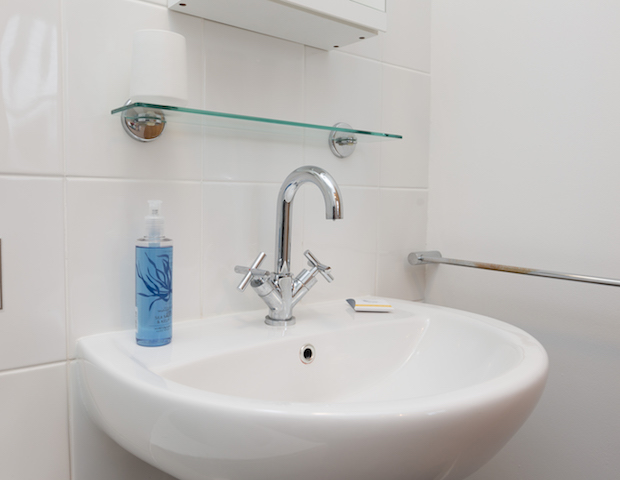
Image resolution: width=620 pixels, height=480 pixels. Find the location of `towel rack`. towel rack is located at coordinates (495, 266).